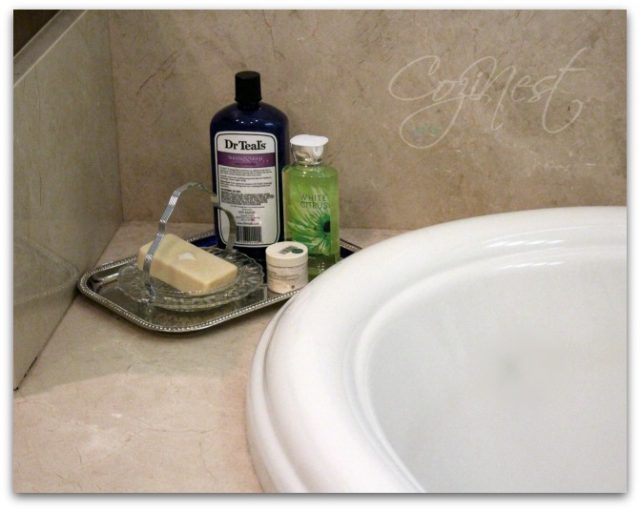
You are a GUI agent. You are given a task and a screenshot of the screen. Output one action in this format:
    pyautogui.click(x=<x>, y=<y>)
    Task: Click on the handle
    The image size is (640, 510).
    Given the screenshot: What is the action you would take?
    pyautogui.click(x=185, y=185)